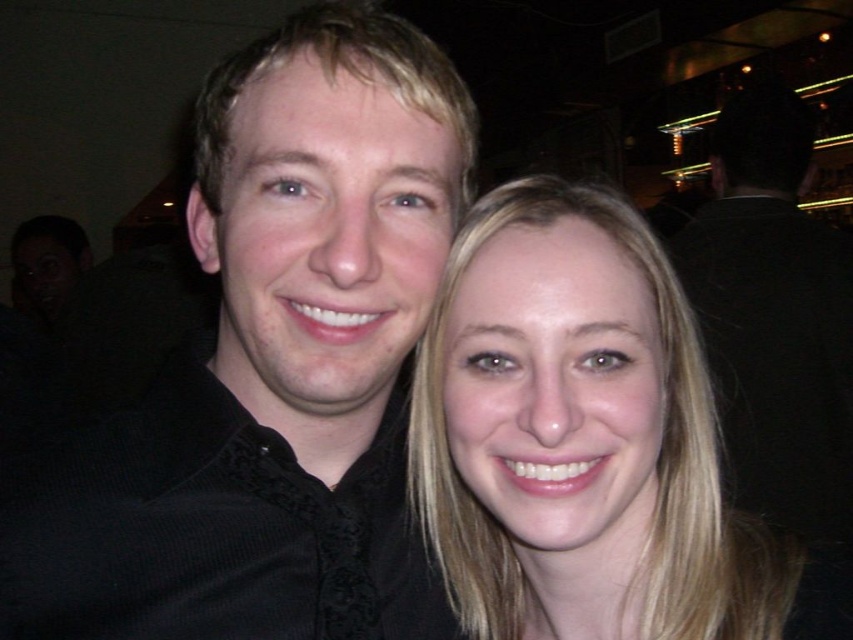
You are a photographer trying to adjust the focus of your camera. You have two points in the image you need to focus on, point [408,620] and point [514,321]. Since you can only focus on one point at a time, which point should you choose to ensure the person closer to the camera is in focus?

Point [408,620] is further to the viewer than point [514,321], so you should focus on point [408,620] to ensure the person closer to the camera is in focus.

You are at a social event and want to locate the black textured shirt at center. According to the coordinates provided, where would you look to find it?

Answer: The black textured shirt at center is located at point (271, 369).